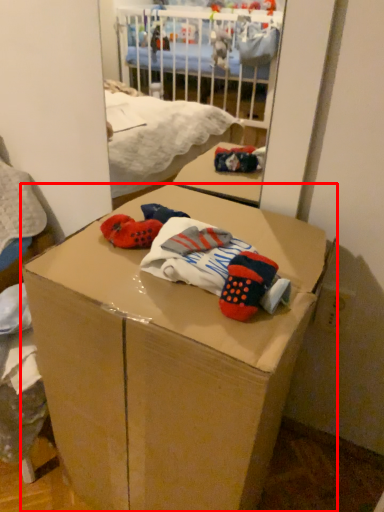
Question: Observing the image, what is the correct spatial positioning of box (annotated by the red box) in reference to baby clothe?

Choices:
 (A) left
 (B) right

Answer: (A)